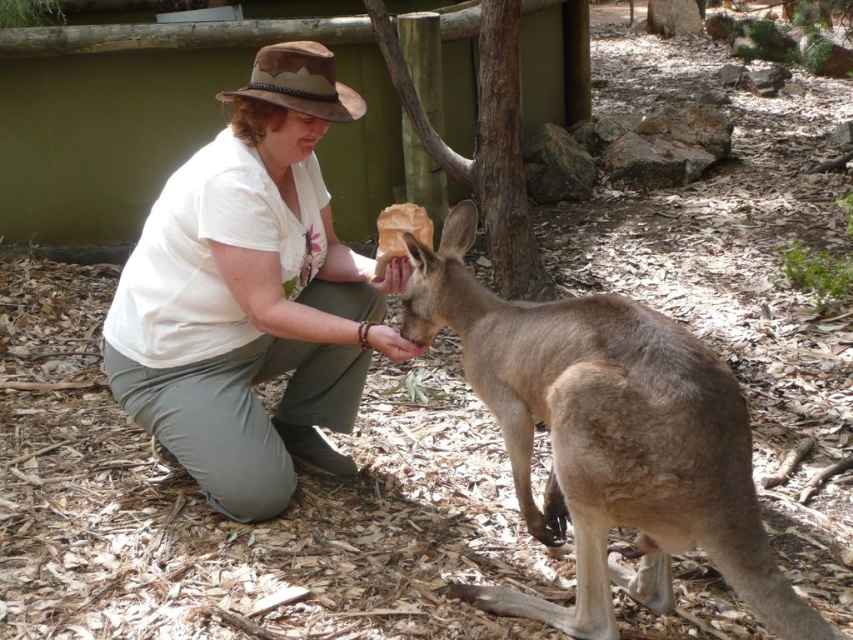
Question: Which of the following is the closest to the observer?

Choices:
 (A) light brown fur at center
 (B) white cotton shirt at center

Answer: (A)

Question: Can you confirm if white cotton shirt at center is wider than light brown fur at center?

Choices:
 (A) yes
 (B) no

Answer: (A)

Question: Which of the following is the closest to the observer?

Choices:
 (A) light brown fur at center
 (B) white cotton shirt at center

Answer: (A)

Question: Does white cotton shirt at center appear on the right side of light brown fur at center?

Choices:
 (A) no
 (B) yes

Answer: (A)

Question: Which of the following is the closest to the observer?

Choices:
 (A) (178, 416)
 (B) (595, 490)

Answer: (B)

Question: Can you confirm if white cotton shirt at center is positioned to the left of light brown fur at center?

Choices:
 (A) no
 (B) yes

Answer: (B)